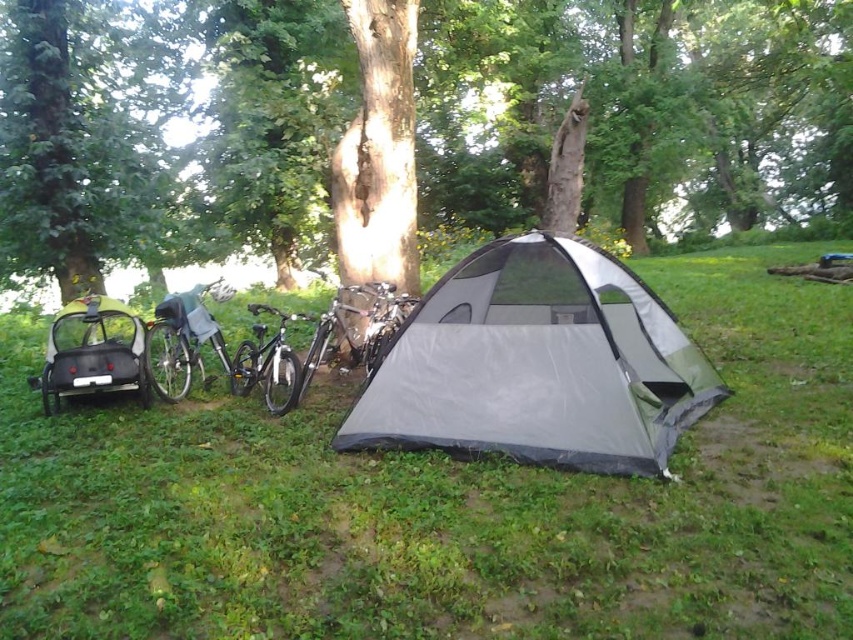
Who is shorter, green grass at center or shiny black bicycle at center?

With less height is green grass at center.

Locate an element on the screen. The height and width of the screenshot is (640, 853). green grass at center is located at coordinates (447, 504).

Who is positioned more to the right, matte black bicycle trailer at left or shiny black bicycle at left?

shiny black bicycle at left is more to the right.

Which is in front, point (56, 372) or point (175, 330)?

Point (56, 372) is in front.

Is point (77, 372) positioned behind point (199, 332)?

No, it is not.

This screenshot has width=853, height=640. Identify the location of matte black bicycle trailer at left. (91, 353).

Does matte black bicycle trailer at left have a greater width compared to shiny black bicycle at center?

Yes.

Which is in front, point (105, 336) or point (251, 372)?

Point (105, 336) is in front.

Who is more forward, (x=122, y=371) or (x=248, y=356)?

Point (x=122, y=371) is more forward.

At what (x,y) coordinates should I click in order to perform the action: click on matte black bicycle trailer at left. Please return your answer as a coordinate pair (x, y). The image size is (853, 640). Looking at the image, I should click on (91, 353).